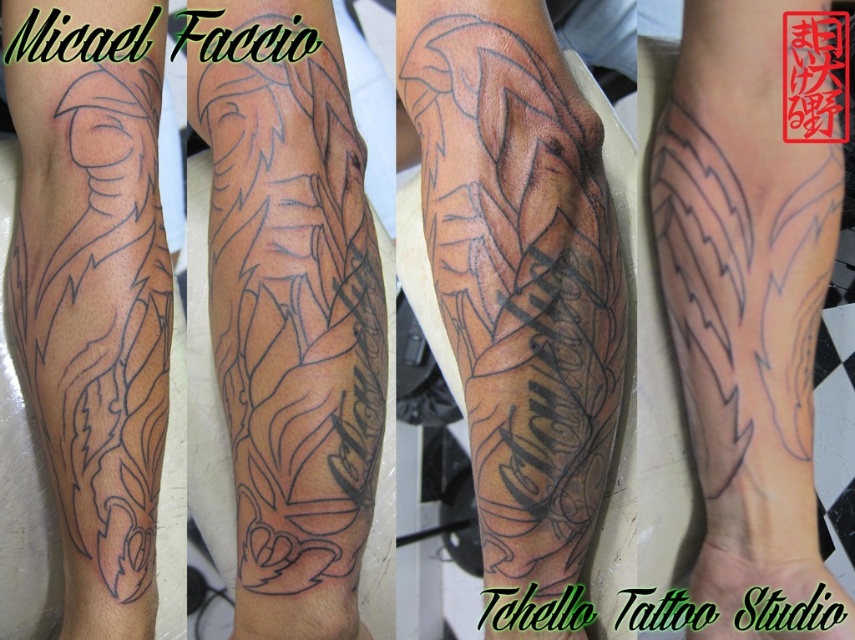
Is black ink tattoo at upper center wider than black outline tattoo at left?

Yes.

What do you see at coordinates (287, 333) in the screenshot? The image size is (855, 640). I see `black ink tattoo at upper center` at bounding box center [287, 333].

Where is `black ink tattoo at upper center`? This screenshot has width=855, height=640. black ink tattoo at upper center is located at coordinates (287, 333).

Can you confirm if black ink tattoo at center is wider than black ink feather at center?

Indeed, black ink tattoo at center has a greater width compared to black ink feather at center.

Which is behind, point (559, 280) or point (789, 394)?

The point (789, 394) is more distant.

This screenshot has width=855, height=640. In order to click on black ink tattoo at center in this screenshot , I will do `click(519, 273)`.

Identify the location of black ink tattoo at upper center. (287, 333).

This screenshot has height=640, width=855. Identify the location of black ink tattoo at upper center. (287, 333).